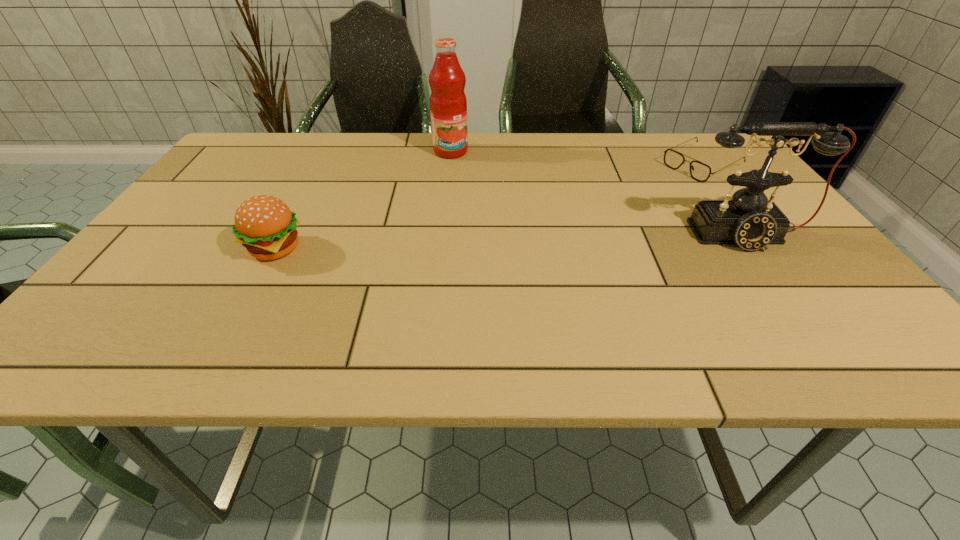
Locate an element on the screen. This screenshot has height=540, width=960. vacant space located on the front-facing side of the sunglasses is located at coordinates (636, 198).

The width and height of the screenshot is (960, 540). I want to click on vacant space situated 0.170m on the front-facing side of the sunglasses, so click(x=636, y=198).

You are a GUI agent. You are given a task and a screenshot of the screen. Output one action in this format:
    pyautogui.click(x=<x>, y=<y>)
    Task: Click on the vacant space situated on the front-facing side of the sunglasses
    Image resolution: width=960 pixels, height=540 pixels.
    Given the screenshot: What is the action you would take?
    pyautogui.click(x=586, y=223)

Locate an element on the screen. Image resolution: width=960 pixels, height=540 pixels. fruit juice at the far edge is located at coordinates (448, 105).

Locate an element on the screen. sunglasses located in the far edge section of the desktop is located at coordinates (699, 171).

The image size is (960, 540). Identify the location of telephone present at the right edge. (749, 220).

Identify the location of sunglasses located in the right edge section of the desktop. (699, 171).

This screenshot has height=540, width=960. Find the location of `object that is at the far right corner`. object that is at the far right corner is located at coordinates (699, 171).

Locate an element on the screen. The width and height of the screenshot is (960, 540). vacant space at the far edge of the desktop is located at coordinates (416, 134).

At what (x,y) coordinates should I click in order to perform the action: click on vacant area at the near edge of the desktop. Please return your answer as a coordinate pair (x, y). Looking at the image, I should click on (266, 318).